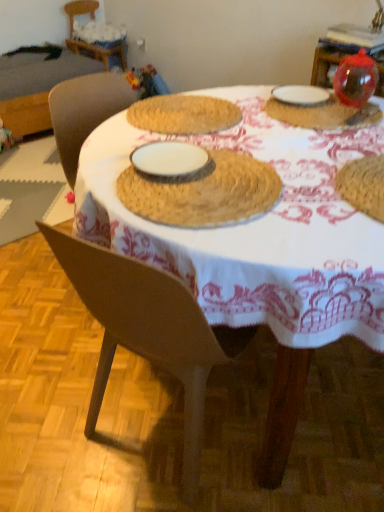
At what (x,y) coordinates should I click in order to perform the action: click on free spot in front of transparent plastic ball at upper right, the 2th tableware in the right-to-left sequence. Please return your answer as a coordinate pair (x, y). This screenshot has height=512, width=384. Looking at the image, I should click on (314, 146).